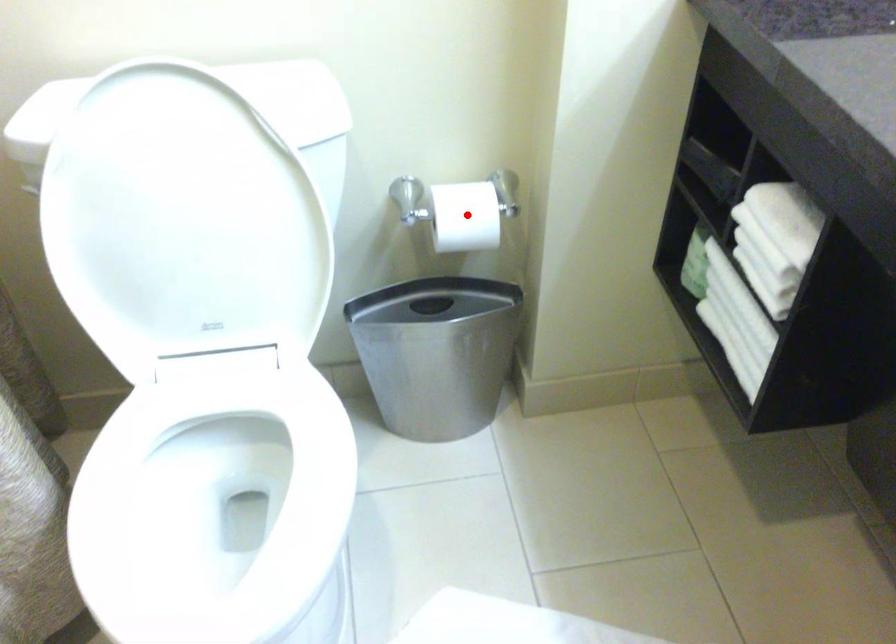
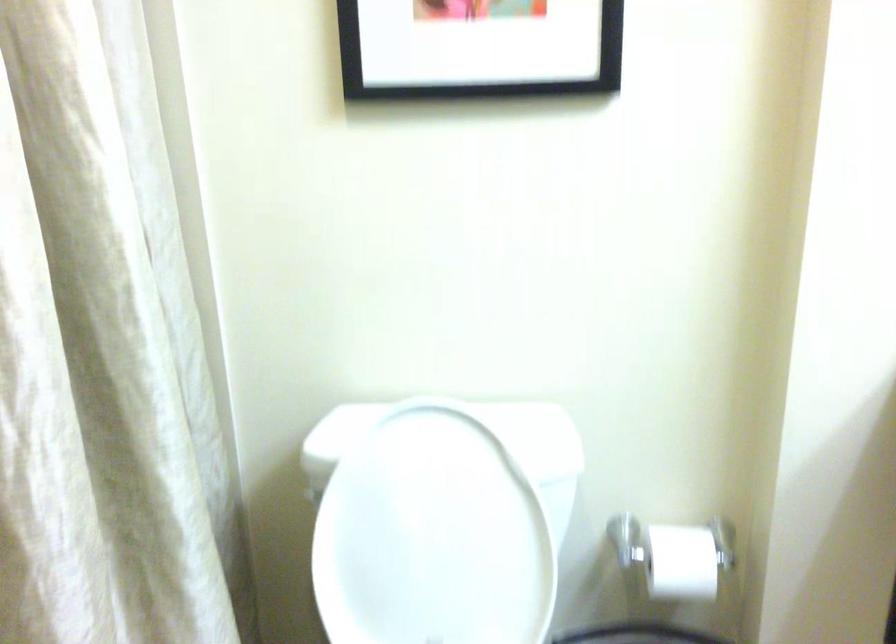
Find the pixel in the second image that matches the highlighted location in the first image.

(682, 562)